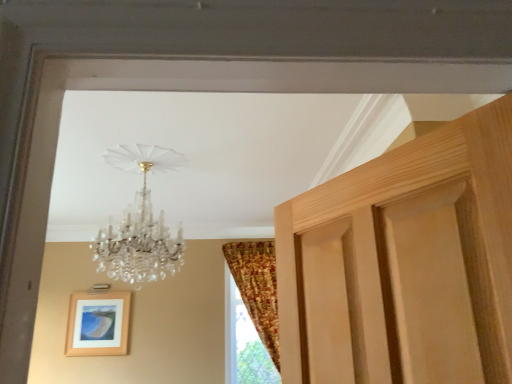
Question: Are patterned fabric curtain at right and crystal glass chandelier at upper center beside each other?

Choices:
 (A) yes
 (B) no

Answer: (B)

Question: Is patterned fabric curtain at right aimed at crystal glass chandelier at upper center?

Choices:
 (A) yes
 (B) no

Answer: (B)

Question: Is patterned fabric curtain at right shorter than crystal glass chandelier at upper center?

Choices:
 (A) yes
 (B) no

Answer: (B)

Question: Can you confirm if patterned fabric curtain at right is taller than crystal glass chandelier at upper center?

Choices:
 (A) no
 (B) yes

Answer: (B)

Question: From a real-world perspective, is patterned fabric curtain at right on crystal glass chandelier at upper center?

Choices:
 (A) no
 (B) yes

Answer: (A)

Question: Is patterned fabric curtain at right wider than crystal glass chandelier at upper center?

Choices:
 (A) yes
 (B) no

Answer: (B)

Question: Can you confirm if patterned fabric curtain at right is shorter than wooden picture frame at lower left?

Choices:
 (A) yes
 (B) no

Answer: (B)

Question: From a real-world perspective, is patterned fabric curtain at right beneath wooden picture frame at lower left?

Choices:
 (A) no
 (B) yes

Answer: (A)

Question: Is patterned fabric curtain at right positioned in front of wooden picture frame at lower left?

Choices:
 (A) yes
 (B) no

Answer: (A)

Question: From the image's perspective, is patterned fabric curtain at right located beneath wooden picture frame at lower left?

Choices:
 (A) no
 (B) yes

Answer: (A)

Question: Can you confirm if patterned fabric curtain at right is thinner than wooden picture frame at lower left?

Choices:
 (A) no
 (B) yes

Answer: (A)

Question: Is there a large distance between patterned fabric curtain at right and wooden picture frame at lower left?

Choices:
 (A) no
 (B) yes

Answer: (B)

Question: From a real-world perspective, is wooden picture frame at lower left on crystal glass chandelier at upper center?

Choices:
 (A) yes
 (B) no

Answer: (B)